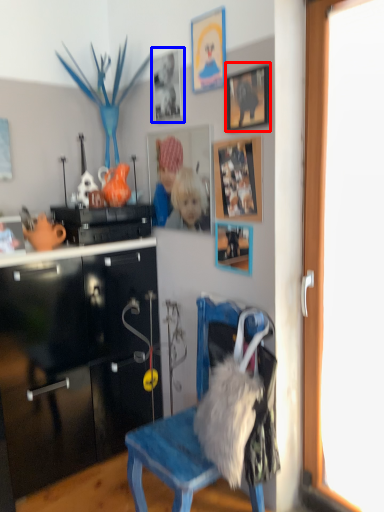
Question: Which object appears farthest to the camera in this image, picture frame (highlighted by a red box) or picture frame (highlighted by a blue box)?

Choices:
 (A) picture frame
 (B) picture frame

Answer: (B)